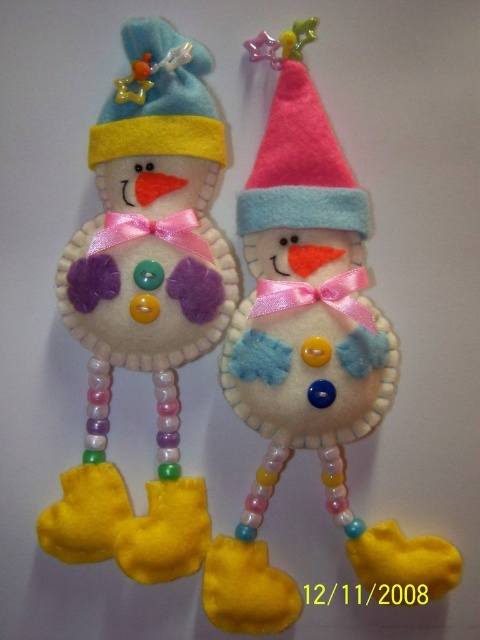
Consider the image. You are hanging these snowmen ornaments on a Christmas tree. The tree has a branch that can support up to 500 grams. The felt snowman at left weighs 300 grams. Can the felt snowman at center be safely placed on the same branch without exceeding the weight limit?

The felt snowman at center is larger in size than the felt snowman at left, which weighs 300 grams. Since the center snowman is larger, it likely weighs more than 300 grams. The branch can only hold up to 500 grams. Therefore, placing the felt snowman at center on the branch may exceed the weight limit if its weight surpasses 200 grams remaining capacity. However, without exact weight information, we cannot confirm safety.